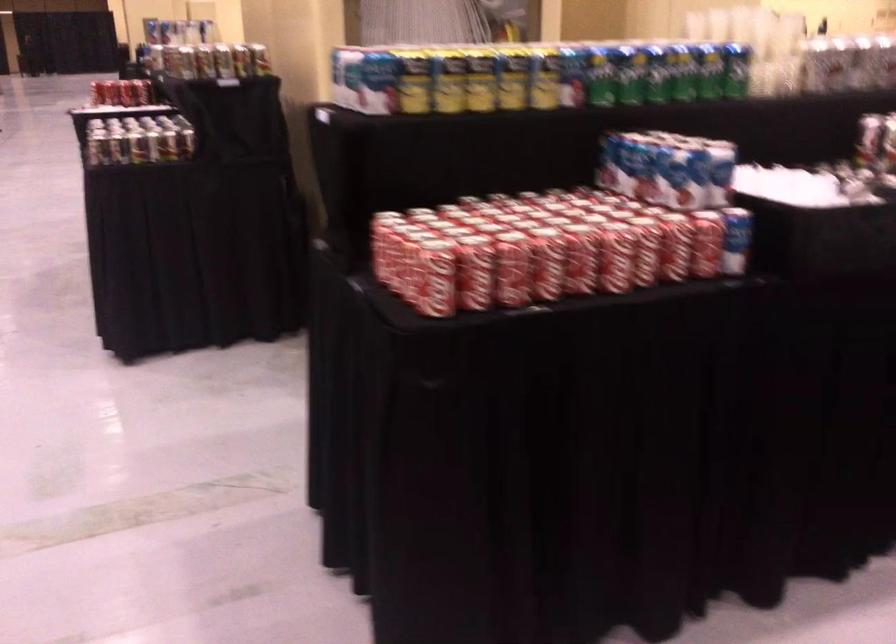
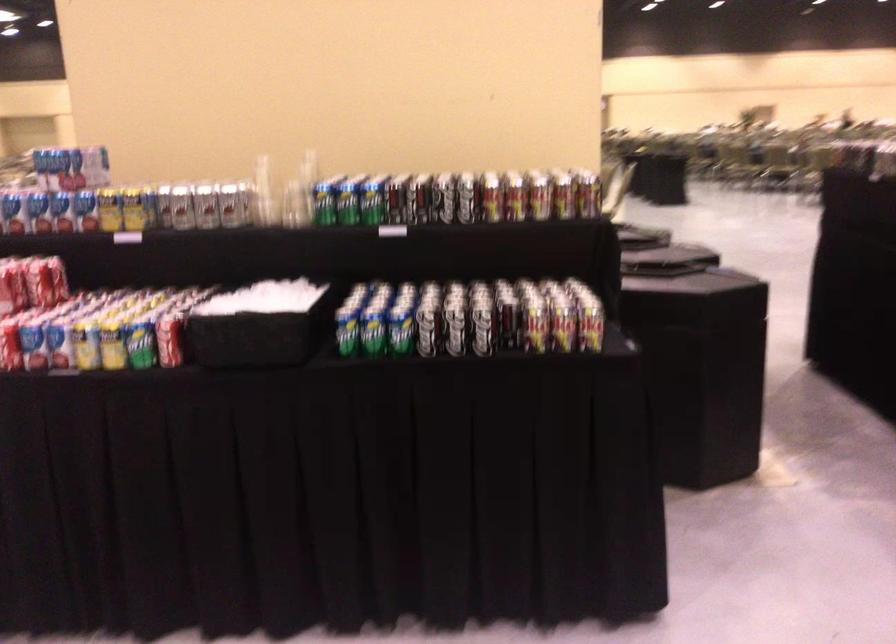
The point at (114, 93) is marked in the first image. Where is the corresponding point in the second image?

(112, 346)